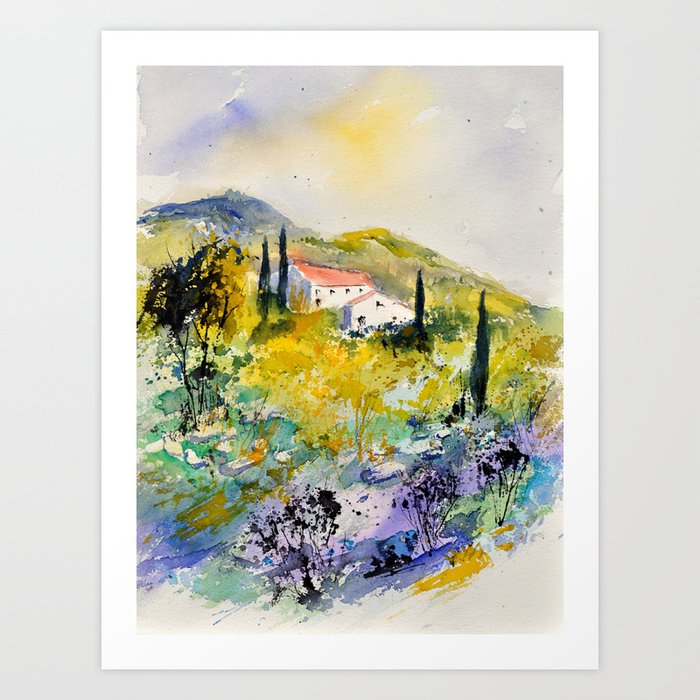
Identify the location of painting. Image resolution: width=700 pixels, height=700 pixels. pyautogui.click(x=437, y=425).